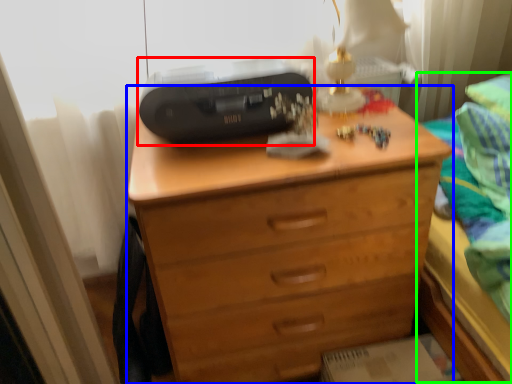
Question: Estimate the real-world distances between objects in this image. Which object is farther from printer (highlighted by a red box), chest of drawers (highlighted by a blue box) or bed (highlighted by a green box)?

Choices:
 (A) chest of drawers
 (B) bed

Answer: (B)